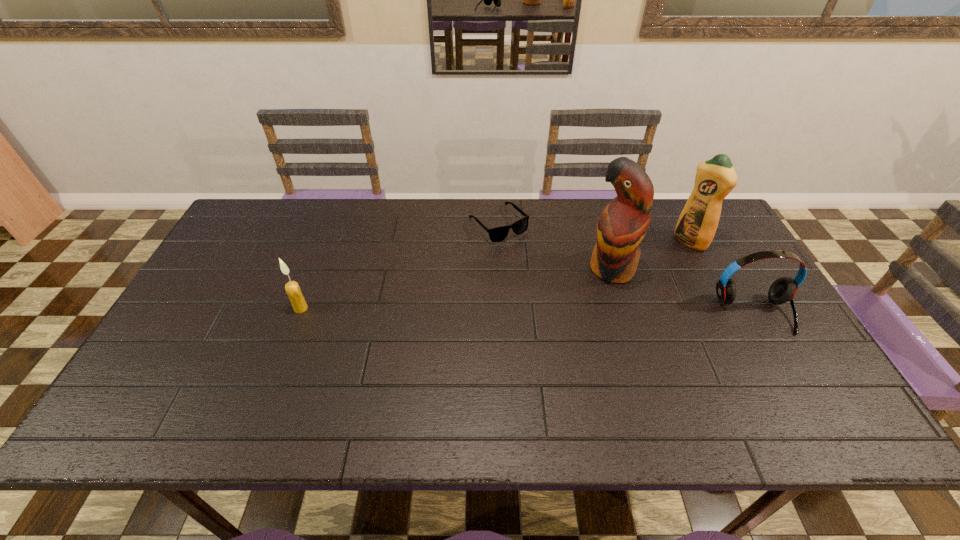
You are a GUI agent. You are given a task and a screenshot of the screen. Output one action in this format:
    pyautogui.click(x=<x>, y=<y>)
    Task: Click on the leftmost object
    
    Given the screenshot: What is the action you would take?
    pyautogui.click(x=292, y=288)

You are a GUI agent. You are given a task and a screenshot of the screen. Output one action in this format:
    pyautogui.click(x=<x>, y=<y>)
    Task: Click on the headset
    
    Given the screenshot: What is the action you would take?
    pyautogui.click(x=782, y=290)

Where is `parrot`? parrot is located at coordinates (623, 223).

Find the location of `the tallest object`. the tallest object is located at coordinates (623, 223).

Find the location of a particular element. The width and height of the screenshot is (960, 540). the shortest object is located at coordinates (497, 234).

Locate an element on the screen. Image resolution: width=960 pixels, height=540 pixels. the fourth object from right to left is located at coordinates 497,234.

The image size is (960, 540). I want to click on the fourth shortest object, so tap(715, 178).

I want to click on vacant area located 0.340m on the right of the leftmost object, so click(433, 308).

Locate an element on the screen. The height and width of the screenshot is (540, 960). free space located 0.090m with the microphone attached to the side of the headset is located at coordinates (784, 366).

Find the location of a particular element. This screenshot has height=540, width=960. free location located 0.360m on the face of the tallest object is located at coordinates (509, 352).